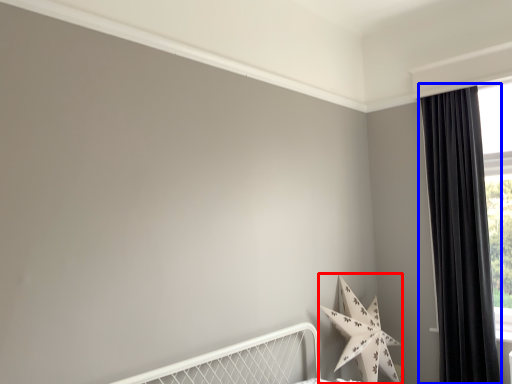
Question: Which point is closer to the camera, star (highlighted by a red box) or curtain (highlighted by a blue box)?

Choices:
 (A) star
 (B) curtain

Answer: (A)